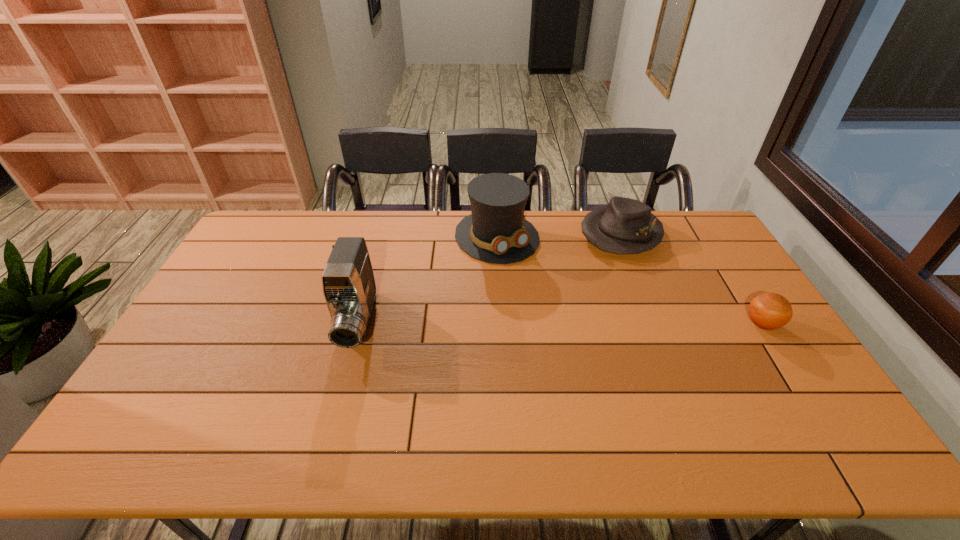
At what (x,y) coordinates should I click in order to perform the action: click on vacant space on the desktop that is between the camcorder and the rightmost object and is positioned on the decorative side of the third object from left to right. Please return your answer as a coordinate pair (x, y). Looking at the image, I should click on (545, 323).

Identify the location of vacant space on the desktop that is between the leftmost object and the rightmost object and is positioned with goggles on the front of the dress hat. The height and width of the screenshot is (540, 960). (581, 323).